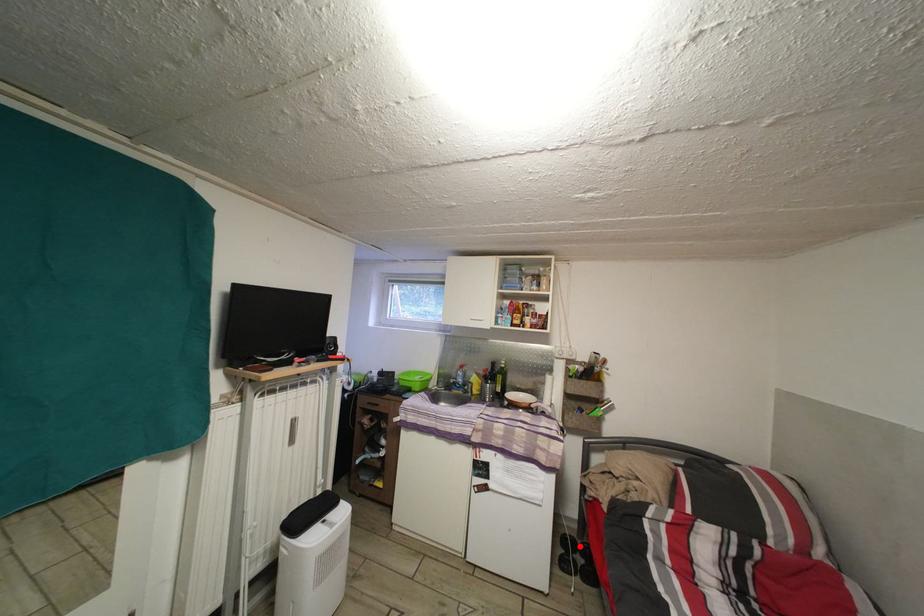
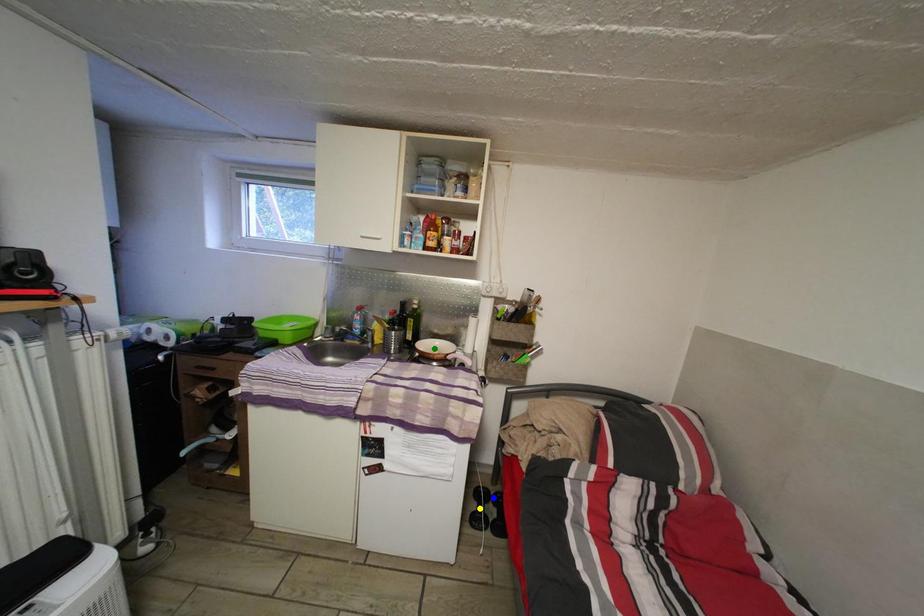
Question: I am providing you with two images of the same scene from different viewpoints. A red point is marked on the first image. You are given multiple points on the second image. Which spot in image 2 lines up with the point in image 1?

Choices:
 (A) green point
 (B) blue point
 (C) yellow point

Answer: (B)